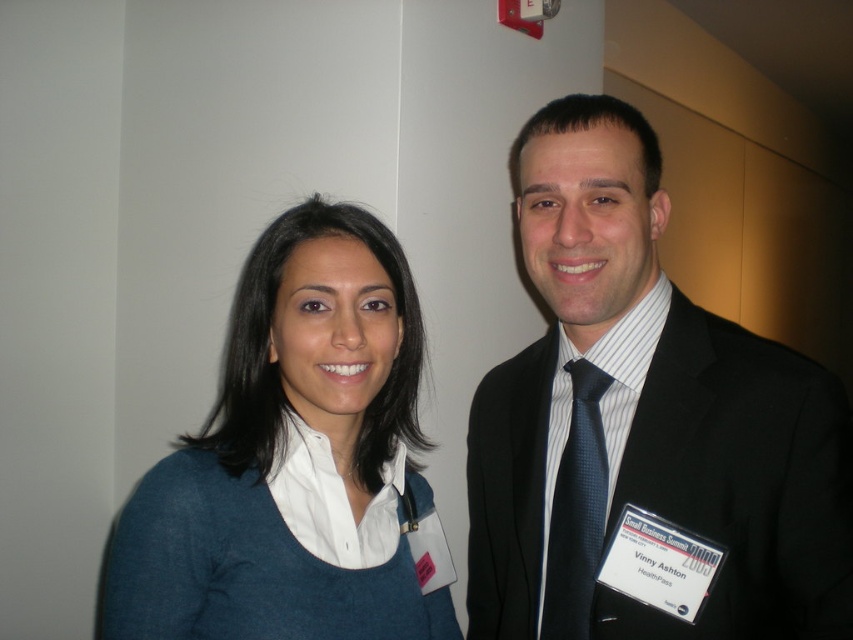
You are attending the Small Business Summit and need to locate the registration desk. You see the black suit at center and the blue fabric shirt at left in front of you. Which direction should you walk to reach the registration desk if it is behind the object that is to the left?

You should walk towards the blue fabric shirt at left because the registration desk is behind the object to the left, which is the blue fabric shirt at left located on the left side.